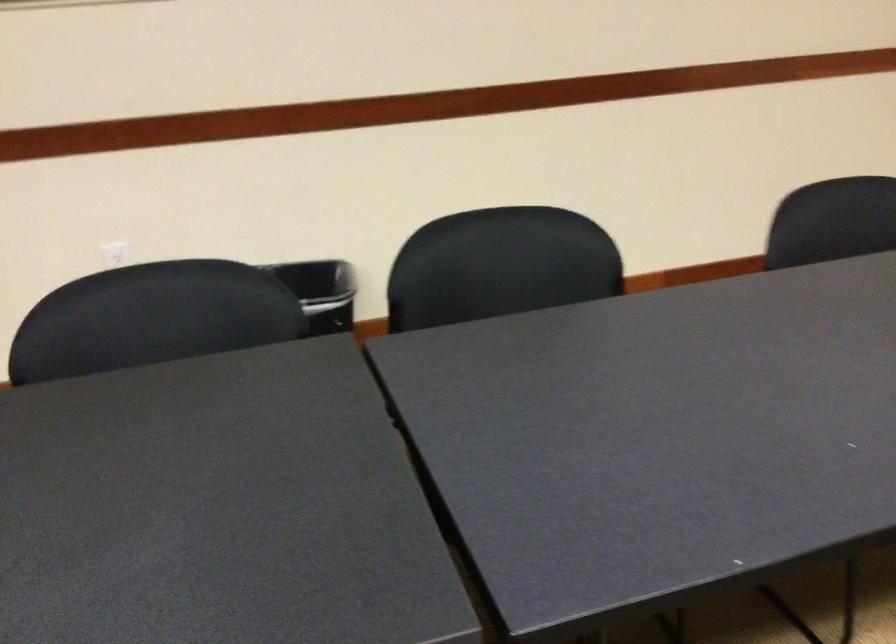
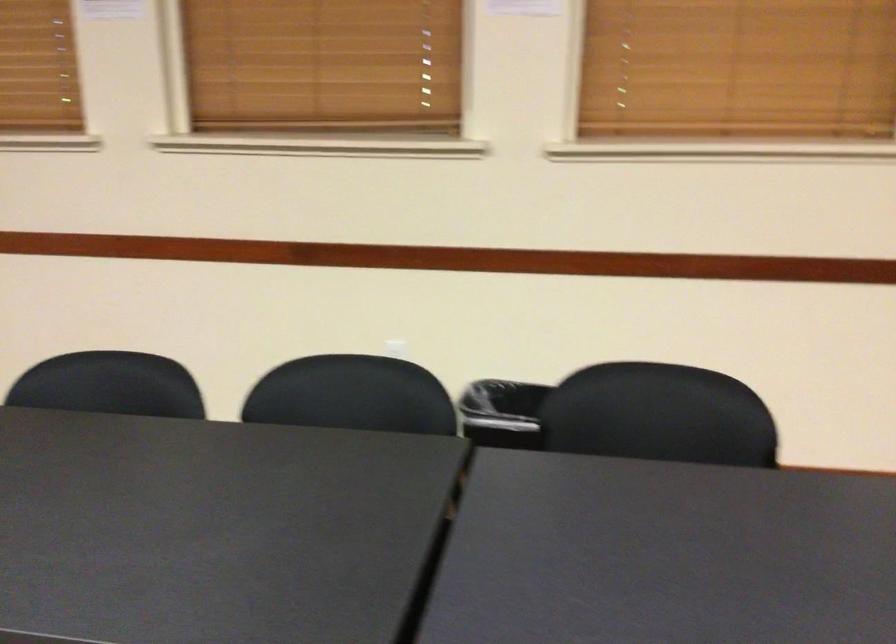
Question: The images are taken continuously from a first-person perspective. In which direction are you moving?

Choices:
 (A) Left
 (B) Right
 (C) Forward
 (D) Backward

Answer: (B)